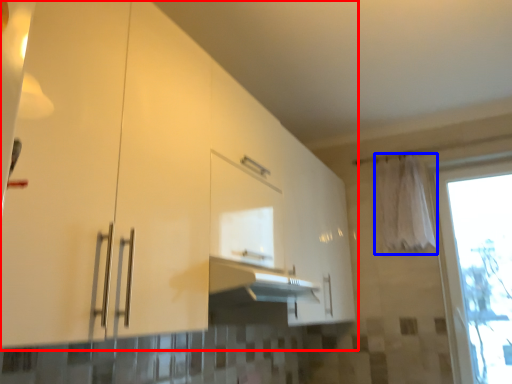
Question: Which object is closer to the camera taking this photo, cabinetry (highlighted by a red box) or curtain (highlighted by a blue box)?

Choices:
 (A) cabinetry
 (B) curtain

Answer: (A)